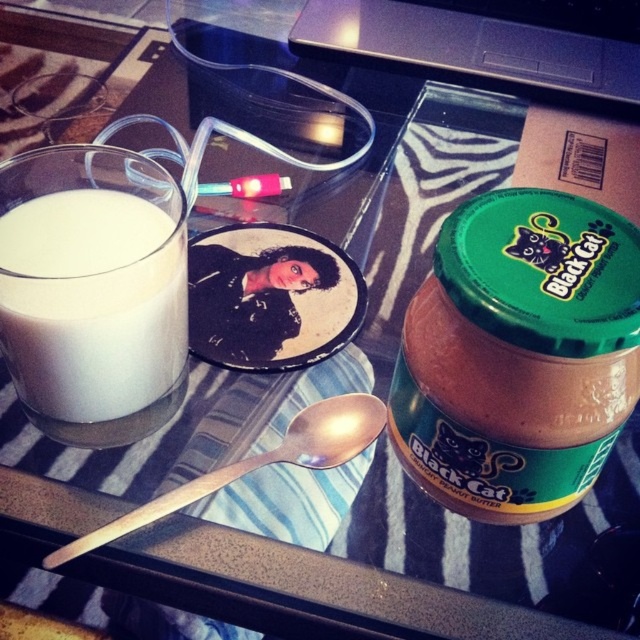
You are holding a 25 cm ruler and want to measure the distance from your eyes to the point marked as point (412, 467) in the image. Can your ruler reach that distance?

The distance between point (412, 467) and the viewer is 26.44 centimeters. Since the ruler is only 25 cm long, it cannot fully reach the distance of 26.44 centimeters.

You are setting up a breakfast table and have a brown smooth peanut butter jar at center right and a white matte glass at left. Which object is wider?

The brown smooth peanut butter jar at center right is wider than the white matte glass at left.

You are setting up a breakfast table and want to place a decorative plate between the white matte glass at left and the wooden spoon at center. Based on their positions, where should you place the plate?

The white matte glass at left is in front of the wooden spoon at center, so you should place the decorative plate behind the white matte glass at left and in front of the wooden spoon at center to position it between them.